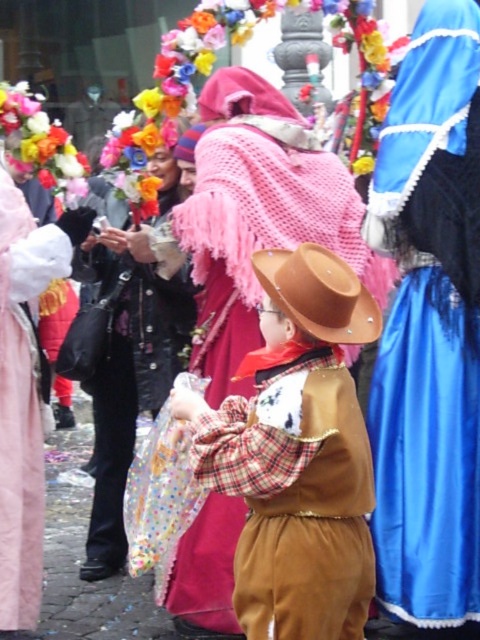
You are a photographer at the event and want to capture both the blue satin dress at center and the brown leather cowboy hat at center in a single frame. Which object should you position closer to the left side of your camera viewfinder to ensure both are visible?

To include both the blue satin dress at center and the brown leather cowboy hat at center in the frame, position the brown leather cowboy hat at center closer to the left side of the camera viewfinder since the blue satin dress at center is to the right of it.

You are a photographer at the event. You need to capture a photo that includes both the black leather jacket at left and the brown leather cowboy hat at center. Based on their positions, which object should you adjust your camera angle to focus on first to ensure both are in frame?

The black leather jacket at left is to the left of the brown leather cowboy hat at center. To capture both in the frame, you should first focus on the brown leather cowboy hat at center since it is positioned further to the right, ensuring the jacket on the left remains within the shot.

You are a costume designer preparing for a parade. You have two items to place on a display rack. The black leather jacket at left and the brown leather cowboy hat at center. Which item requires more space on the display rack?

The black leather jacket at left requires more space on the display rack because it has a larger size compared to the brown leather cowboy hat at center.